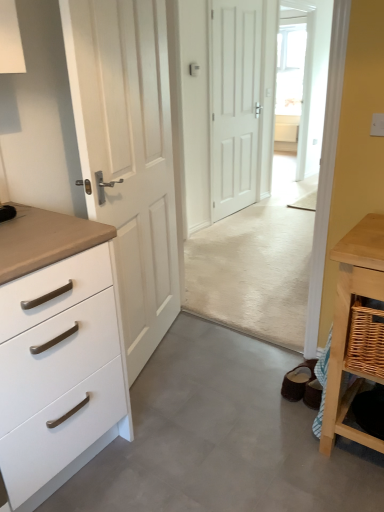
This screenshot has height=512, width=384. I want to click on free space in front of white wood door at left, positioned as the second door in back-to-front order, so click(x=191, y=413).